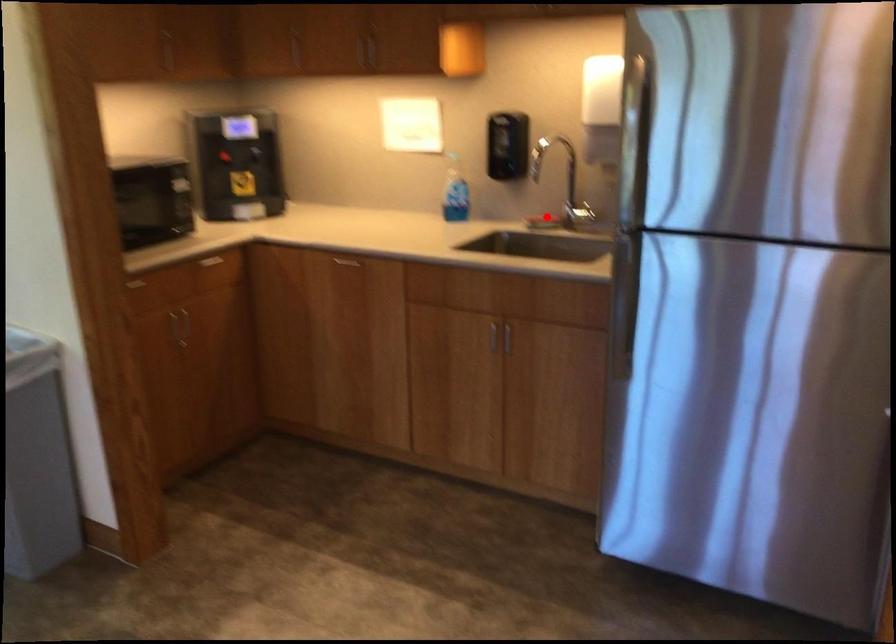
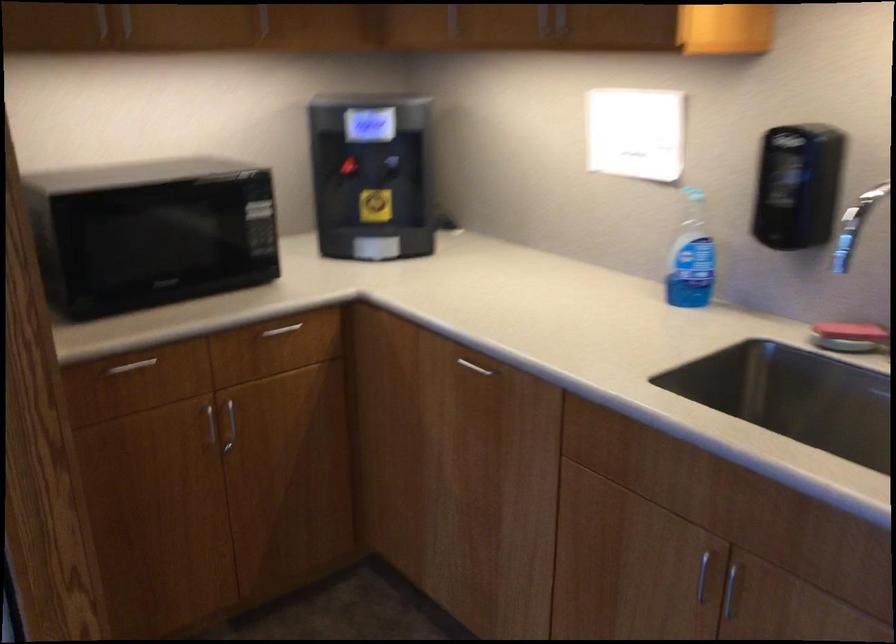
In the second image, find the point that corresponds to the highlighted location in the first image.

(848, 337)